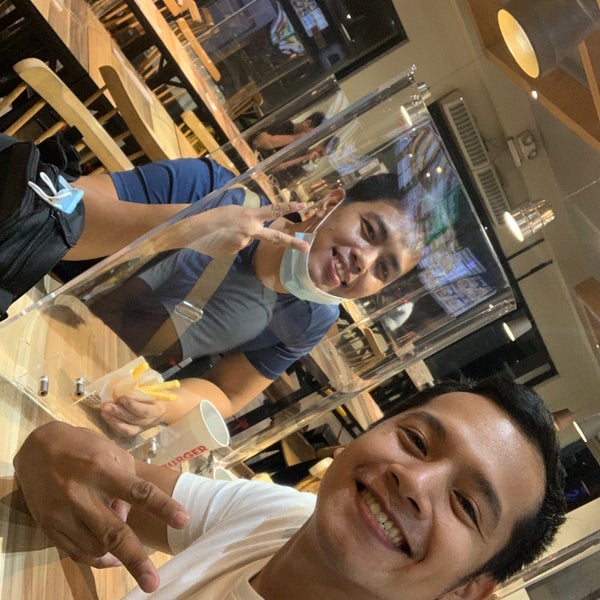
Where is `window`? Image resolution: width=600 pixels, height=600 pixels. window is located at coordinates (405, 401).